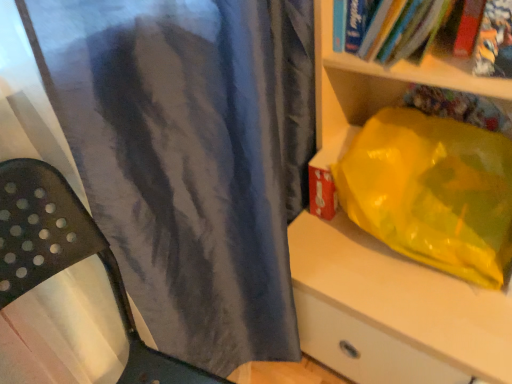
Question: From a real-world perspective, is hardcover book at upper right, which is the first book in right-to-left order, above or below hardcover book at upper right, positioned as the 2th book in right-to-left order?

Choices:
 (A) above
 (B) below

Answer: (A)

Question: Considering the relative positions of hardcover book at upper right, which is the first book in right-to-left order, and hardcover book at upper right, the first book viewed from the left, in the image provided, is hardcover book at upper right, which is the first book in right-to-left order, to the left or to the right of hardcover book at upper right, the first book viewed from the left,?

Choices:
 (A) right
 (B) left

Answer: (A)

Question: Which of these objects is positioned farthest from the hardcover book at upper right, the first book viewed from the left?

Choices:
 (A) matte gray curtain at center
 (B) hardcover book at upper right, the 2th book in the left-to-right sequence
 (C) matte plastic bag at right

Answer: (A)

Question: Which object is the closest to the hardcover book at upper right, the 2th book in the left-to-right sequence?

Choices:
 (A) matte gray curtain at center
 (B) matte plastic bag at right
 (C) hardcover book at upper right, positioned as the 2th book in right-to-left order

Answer: (C)